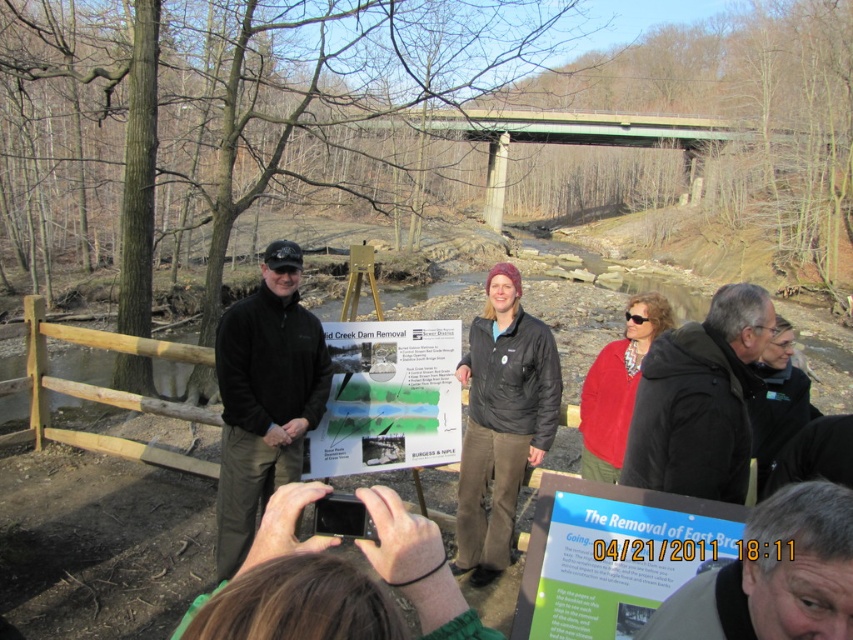
You are a photographer trying to capture a clear shot of both the blue glossy poster at center and the red matte jacket at center. Since you want to ensure both are visible in the frame, which object should you focus on first to avoid blurring, considering their sizes?

The blue glossy poster at center is not as tall as the red matte jacket at center, so you should focus on the red matte jacket at center first since it is larger and might require more precise focusing to ensure clarity.

You are a photographer trying to capture a photo of the creek dam removal event. You notice the gray fabric jacket at center and the green concrete bridge at upper center in your viewfinder. Which object should you adjust your camera angle to focus on if you want to highlight the taller object?

The green concrete bridge at upper center is taller than the gray fabric jacket at center, so you should adjust your camera angle to focus on the green concrete bridge at upper center to highlight the taller object.

You are a photographer at the dam removal event. You want to take a photo of the gray fabric jacket at center and the green concrete bridge at upper center so that both are clearly visible. Based on their positions, where should you position the camera relative to the jacket?

The gray fabric jacket at center is positioned under the green concrete bridge at upper center, so to capture both clearly, position the camera above the jacket to ensure the bridge is visible above it without obstruction.